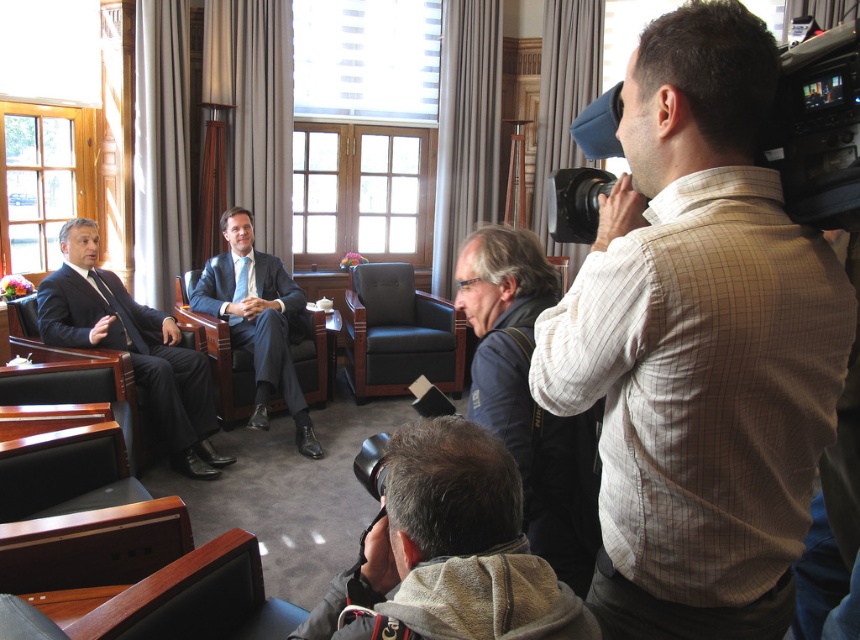
Consider the image. Is gray fleece jacket at lower center taller than black plastic video camera at upper right?

Indeed, gray fleece jacket at lower center has a greater height compared to black plastic video camera at upper right.

Between gray fleece jacket at lower center and black plastic video camera at upper right, which one has less height?

Standing shorter between the two is black plastic video camera at upper right.

You are a GUI agent. You are given a task and a screenshot of the screen. Output one action in this format:
    pyautogui.click(x=<x>, y=<y>)
    Task: Click on the gray fleece jacket at lower center
    This screenshot has width=860, height=640.
    Given the screenshot: What is the action you would take?
    pyautogui.click(x=452, y=548)

Which is above, matte black suit at left or leather armchair at center?

Positioned higher is leather armchair at center.

Can you confirm if matte black suit at left is bigger than leather armchair at center?

Yes, matte black suit at left is bigger than leather armchair at center.

Does point (86, 269) lie behind point (413, 342)?

No, (86, 269) is in front of (413, 342).

Find the location of a particular element. matte black suit at left is located at coordinates (132, 348).

Can you confirm if black plastic video camera at upper right is positioned above leather armchair at center?

Yes.

The image size is (860, 640). What do you see at coordinates (817, 129) in the screenshot?
I see `black plastic video camera at upper right` at bounding box center [817, 129].

The width and height of the screenshot is (860, 640). I want to click on black plastic video camera at upper right, so click(x=817, y=129).

Where is `black plastic video camera at upper right`? This screenshot has height=640, width=860. black plastic video camera at upper right is located at coordinates (817, 129).